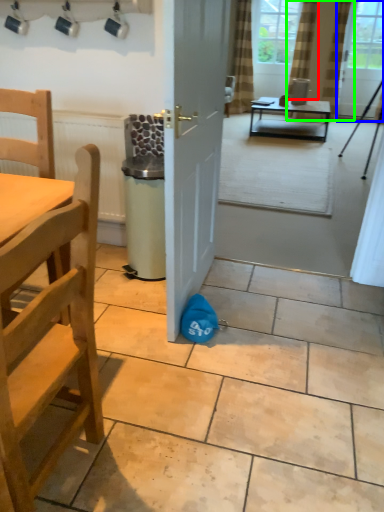
Question: Estimate the real-world distances between objects in this image. Which object is farther from curtain (highlighted by a red box), window screen (highlighted by a blue box) or curtain (highlighted by a green box)?

Choices:
 (A) window screen
 (B) curtain

Answer: (A)